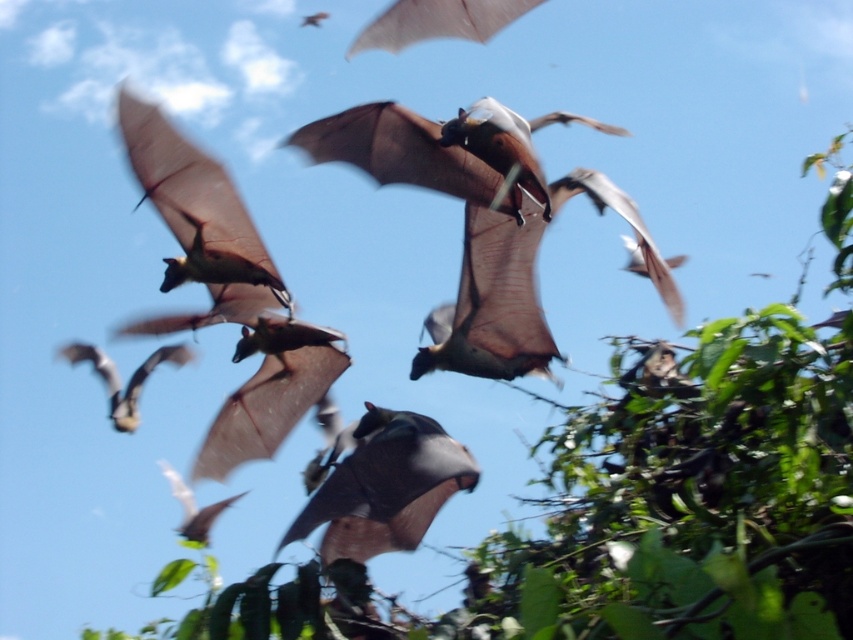
Question: Can you confirm if green leafy tree at center is thinner than gray matte bat at center?

Choices:
 (A) no
 (B) yes

Answer: (A)

Question: Can you confirm if green leafy tree at center is thinner than gray matte bat at center?

Choices:
 (A) yes
 (B) no

Answer: (B)

Question: Which of the following is the closest to the observer?

Choices:
 (A) gray matte bat at center
 (B) green leafy tree at center

Answer: (B)

Question: Among these objects, which one is farthest from the camera?

Choices:
 (A) gray matte bat at center
 (B) green leafy tree at center

Answer: (A)

Question: Is green leafy tree at center to the right of gray matte bat at center from the viewer's perspective?

Choices:
 (A) yes
 (B) no

Answer: (A)

Question: Which point is farther to the camera?

Choices:
 (A) (352, 577)
 (B) (349, 481)

Answer: (B)